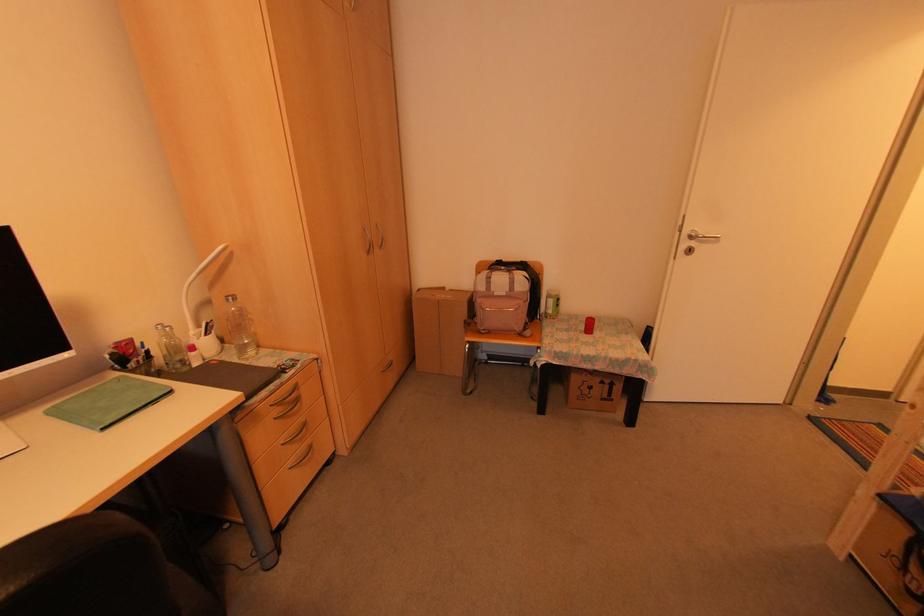
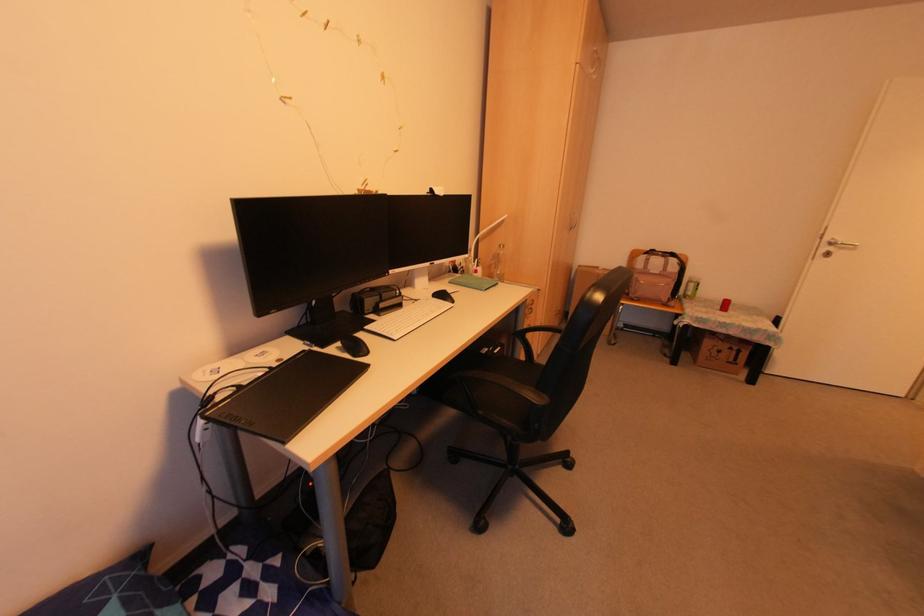
In a continuous first-person perspective shot, in which direction is the camera moving?

The cameraman moved toward left, backward.